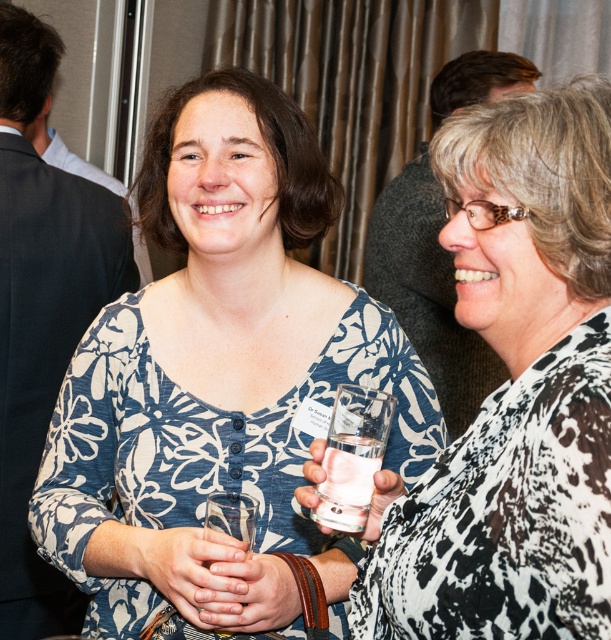
Who is lower down, white glossy glass at center or clear glass at center?

clear glass at center is lower down.

Is point (595, 307) behind point (348, 456)?

No.

Identify the location of white glossy glass at center. The width and height of the screenshot is (611, 640). (514, 390).

Describe the element at coordinates (218, 378) in the screenshot. I see `blue floral shirt at center` at that location.

Which is more to the left, blue floral shirt at center or white glossy glass at center?

blue floral shirt at center

Which is behind, point (104, 394) or point (598, 490)?

The point (104, 394) is more distant.

This screenshot has width=611, height=640. In order to click on blue floral shirt at center in this screenshot , I will do `click(218, 378)`.

From the picture: Between blue floral shirt at center and clear glass at center, which one has less height?

With less height is clear glass at center.

Is blue floral shirt at center wider than clear glass at center?

Yes, blue floral shirt at center is wider than clear glass at center.

Where is `blue floral shirt at center`? blue floral shirt at center is located at coordinates (218, 378).